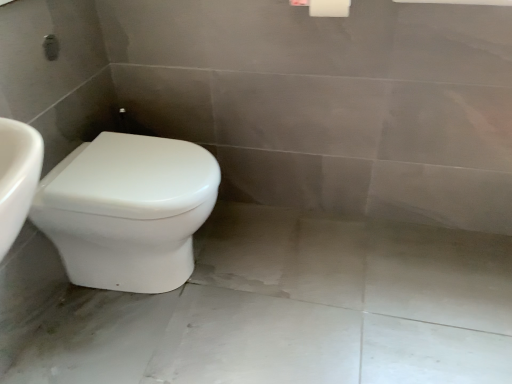
This screenshot has height=384, width=512. What do you see at coordinates (128, 210) in the screenshot?
I see `white glossy toilet at lower left` at bounding box center [128, 210].

Where is `white glossy toilet at lower left`? white glossy toilet at lower left is located at coordinates (128, 210).

Describe the element at coordinates (295, 309) in the screenshot. I see `white glossy concrete at lower left` at that location.

I want to click on white glossy concrete at lower left, so click(295, 309).

This screenshot has height=384, width=512. I want to click on white glossy toilet at lower left, so 128,210.

Between white glossy toilet at lower left and white glossy concrete at lower left, which one appears on the right side from the viewer's perspective?

Positioned to the right is white glossy concrete at lower left.

Which is in front, white glossy toilet at lower left or white glossy concrete at lower left?

white glossy concrete at lower left is more forward.

Is point (152, 244) less distant than point (249, 294)?

Yes, point (152, 244) is closer to viewer.

From the image's perspective, between white glossy toilet at lower left and white glossy concrete at lower left, who is located below?

From the image's view, white glossy concrete at lower left is below.

From a real-world perspective, is white glossy toilet at lower left beneath white glossy concrete at lower left?

No, from a real-world perspective, white glossy toilet at lower left is not below white glossy concrete at lower left.

Is white glossy toilet at lower left thinner than white glossy concrete at lower left?

Indeed, white glossy toilet at lower left has a lesser width compared to white glossy concrete at lower left.

Between white glossy toilet at lower left and white glossy concrete at lower left, which one has more height?

Standing taller between the two is white glossy toilet at lower left.

Is white glossy toilet at lower left smaller than white glossy concrete at lower left?

Incorrect, white glossy toilet at lower left is not smaller in size than white glossy concrete at lower left.

Is white glossy toilet at lower left positioned beyond the bounds of white glossy concrete at lower left?

white glossy toilet at lower left lies outside white glossy concrete at lower left's area.

Is white glossy toilet at lower left positioned far away from white glossy concrete at lower left?

No, white glossy toilet at lower left is not far from white glossy concrete at lower left.

Could you tell me if white glossy toilet at lower left is turned towards white glossy concrete at lower left?

Yes, white glossy toilet at lower left is turned towards white glossy concrete at lower left.

You are a GUI agent. You are given a task and a screenshot of the screen. Output one action in this format:
    pyautogui.click(x=<x>, y=<y>)
    Task: Click on the concrete below the white glossy toilet at lower left (from a real-world perspective)
    
    Given the screenshot: What is the action you would take?
    pyautogui.click(x=295, y=309)

From the picture: Between white glossy concrete at lower left and white glossy toilet at lower left, which one appears on the right side from the viewer's perspective?

white glossy concrete at lower left is more to the right.

Between white glossy concrete at lower left and white glossy toilet at lower left, which one is positioned in front?

white glossy concrete at lower left.

Between point (321, 308) and point (132, 203), which one is positioned in front?

The point (132, 203) is in front.

From the image's perspective, which object appears higher, white glossy concrete at lower left or white glossy toilet at lower left?

white glossy toilet at lower left, from the image's perspective.

From a real-world perspective, is white glossy concrete at lower left physically above white glossy toilet at lower left?

No, from a real-world perspective, white glossy concrete at lower left is not over white glossy toilet at lower left

Which object is wider, white glossy concrete at lower left or white glossy toilet at lower left?

white glossy concrete at lower left is wider.

Who is shorter, white glossy concrete at lower left or white glossy toilet at lower left?

white glossy concrete at lower left.

Between white glossy concrete at lower left and white glossy toilet at lower left, which one has smaller size?

Smaller between the two is white glossy concrete at lower left.

Is white glossy toilet at lower left located within white glossy concrete at lower left?

No, white glossy concrete at lower left does not contain white glossy toilet at lower left.

Can you see white glossy concrete at lower left touching white glossy toilet at lower left?

No, white glossy concrete at lower left is not touching white glossy toilet at lower left.

Is white glossy concrete at lower left facing towards white glossy toilet at lower left?

No, white glossy concrete at lower left does not turn towards white glossy toilet at lower left.

Measure the distance between white glossy concrete at lower left and white glossy toilet at lower left.

A distance of 14.95 inches exists between white glossy concrete at lower left and white glossy toilet at lower left.

Locate an element on the screen. concrete that is on the right side of white glossy toilet at lower left is located at coordinates (295, 309).

At what (x,y) coordinates should I click in order to perform the action: click on toilet that appears above the white glossy concrete at lower left (from the image's perspective). Please return your answer as a coordinate pair (x, y). Looking at the image, I should click on (128, 210).

At what (x,y) coordinates should I click in order to perform the action: click on concrete below the white glossy toilet at lower left (from a real-world perspective). Please return your answer as a coordinate pair (x, y). Looking at the image, I should click on pos(295,309).